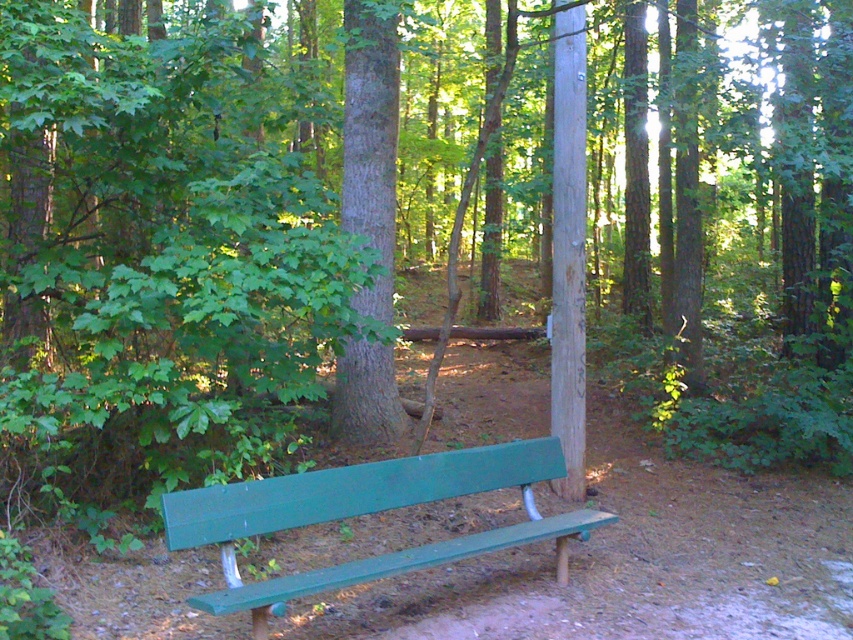
In the scene shown: You are a hiker who wants to sit on the green painted wood bench at center. As you approach, you notice a green rough bark tree at center. Which direction should you move relative to the tree to reach the bench?

The green painted wood bench at center is to the right of the green rough bark tree at center, so you should move to the right of the tree to reach the bench.

From the picture: You are a hiker who wants to take a photo of the green painted wood bench at center and the green rough bark tree at center from a distance. Which object will appear smaller in the photo?

The green painted wood bench at center will appear smaller in the photo because it is not as tall as the green rough bark tree at center, so the tree will appear larger in the photo.